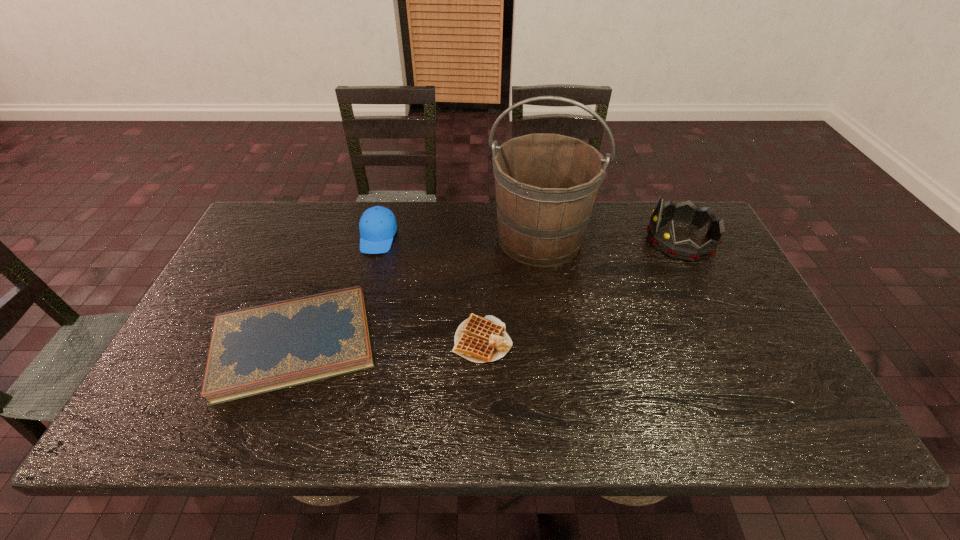
You are a GUI agent. You are given a task and a screenshot of the screen. Output one action in this format:
    pyautogui.click(x=<x>, y=<y>)
    Task: Click on the free spot that satisfies the following two spatial constraints: 1. on the back side of the bucket; 2. on the right side of the waffle
    
    Given the screenshot: What is the action you would take?
    pyautogui.click(x=482, y=238)